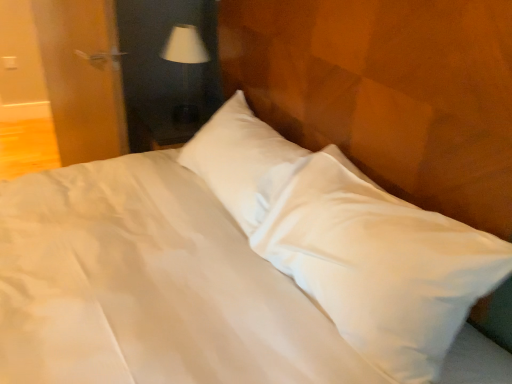
Question: From a real-world perspective, does wooden door at left stand above white plastic electric outlet at upper left?

Choices:
 (A) yes
 (B) no

Answer: (A)

Question: From a real-world perspective, is wooden door at left below white plastic electric outlet at upper left?

Choices:
 (A) yes
 (B) no

Answer: (B)

Question: Considering the relative positions of wooden door at left and white plastic electric outlet at upper left in the image provided, is wooden door at left to the right of white plastic electric outlet at upper left from the viewer's perspective?

Choices:
 (A) yes
 (B) no

Answer: (A)

Question: Does wooden door at left lie behind white plastic electric outlet at upper left?

Choices:
 (A) no
 (B) yes

Answer: (A)

Question: Is wooden door at left at the left side of white plastic electric outlet at upper left?

Choices:
 (A) yes
 (B) no

Answer: (B)

Question: Is wooden door at left placed right next to white plastic electric outlet at upper left?

Choices:
 (A) yes
 (B) no

Answer: (B)

Question: Considering the relative positions of white plastic electric outlet at upper left and wooden door at left in the image provided, is white plastic electric outlet at upper left behind wooden door at left?

Choices:
 (A) yes
 (B) no

Answer: (A)

Question: Can you confirm if white plastic electric outlet at upper left is shorter than wooden door at left?

Choices:
 (A) no
 (B) yes

Answer: (B)

Question: From a real-world perspective, does white plastic electric outlet at upper left stand above wooden door at left?

Choices:
 (A) yes
 (B) no

Answer: (B)

Question: Does white plastic electric outlet at upper left have a greater width compared to wooden door at left?

Choices:
 (A) no
 (B) yes

Answer: (A)

Question: Considering the relative positions of white plastic electric outlet at upper left and wooden door at left in the image provided, is white plastic electric outlet at upper left in front of wooden door at left?

Choices:
 (A) no
 (B) yes

Answer: (A)

Question: From a real-world perspective, does white plastic electric outlet at upper left sit lower than wooden door at left?

Choices:
 (A) no
 (B) yes

Answer: (B)

Question: Is white plastic electric outlet at upper left smaller than white fabric lampshade at upper center?

Choices:
 (A) no
 (B) yes

Answer: (B)